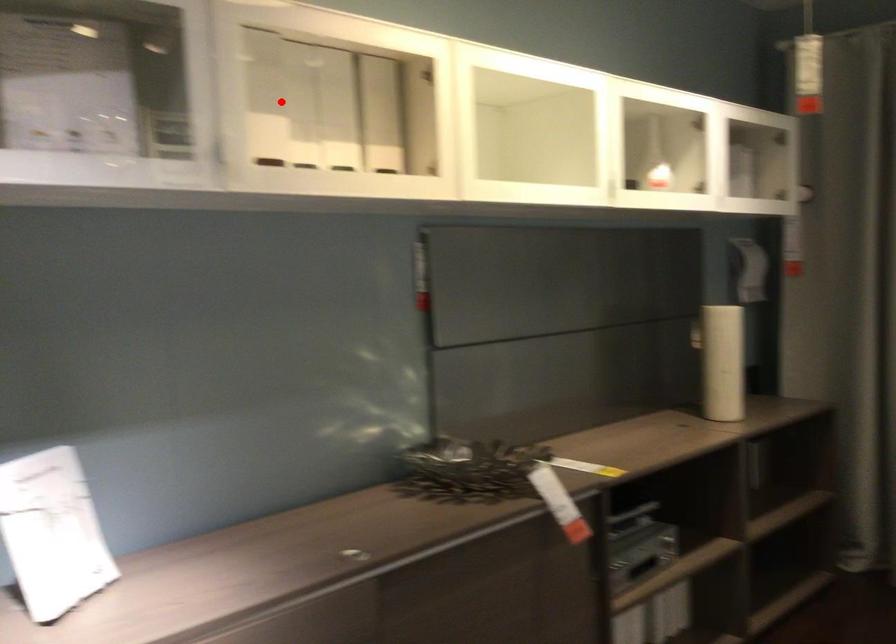
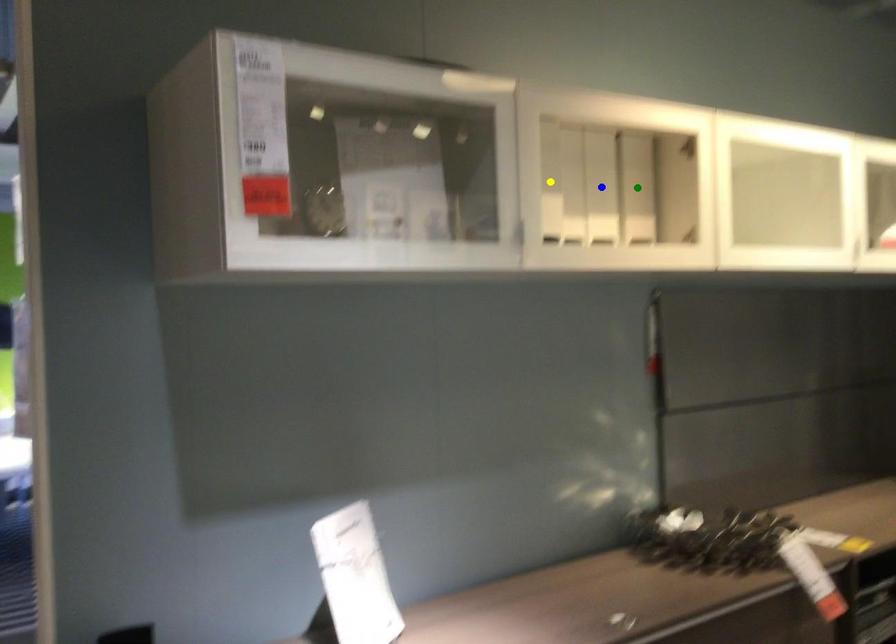
Question: I am providing you with two images of the same scene from different viewpoints. A red point is marked on the first image. You are given multiple points on the second image. Which spot in image 2 lines up with the point in image 1?

Choices:
 (A) blue point
 (B) yellow point
 (C) green point

Answer: (B)